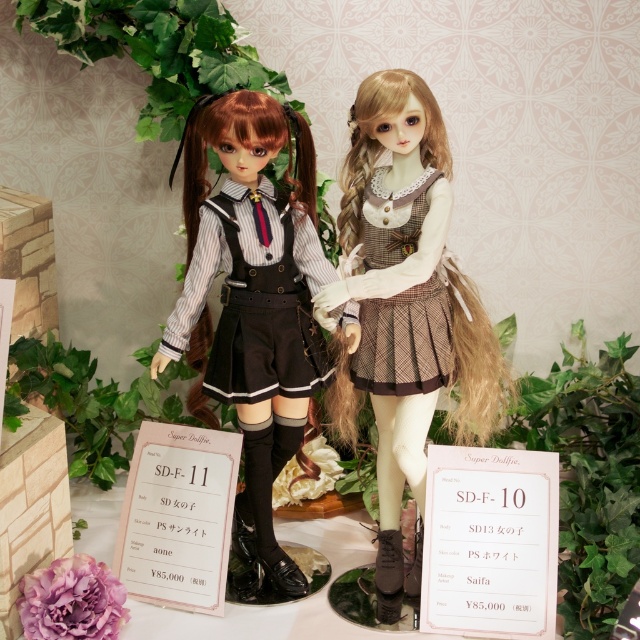
Question: Is matte black uniform at center bigger than matte black dress at center?

Choices:
 (A) yes
 (B) no

Answer: (A)

Question: Which object is positioned farthest from the matte black uniform at center?

Choices:
 (A) brown plaid dress at center
 (B) matte black dress at center

Answer: (A)

Question: Which object is closer to the camera taking this photo?

Choices:
 (A) matte black dress at center
 (B) brown plaid dress at center
 (C) matte black uniform at center

Answer: (C)

Question: Which of the following is the farthest from the observer?

Choices:
 (A) (282, 280)
 (B) (435, 348)
 (C) (292, 561)
 (D) (442, 312)

Answer: (C)

Question: Does matte black uniform at center have a greater width compared to matte black dress at center?

Choices:
 (A) no
 (B) yes

Answer: (B)

Question: Is matte black uniform at center bigger than matte black dress at center?

Choices:
 (A) yes
 (B) no

Answer: (A)